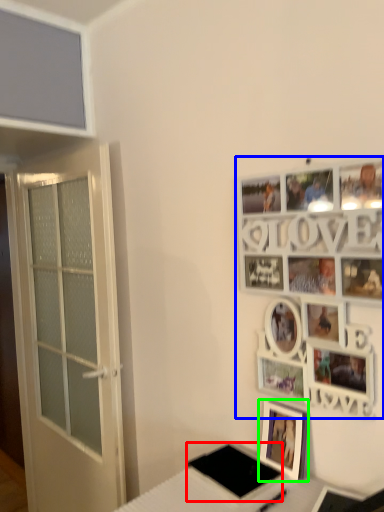
Question: Based on their relative distances, which object is nearer to pad (highlighted by a red box)? Choose from picture frame (highlighted by a blue box) and picture frame (highlighted by a green box).

Choices:
 (A) picture frame
 (B) picture frame

Answer: (B)